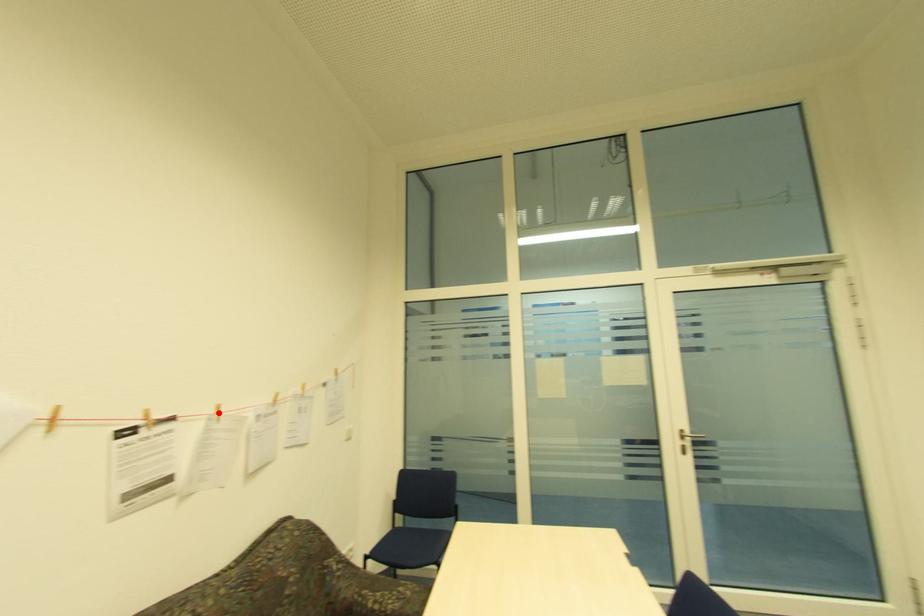
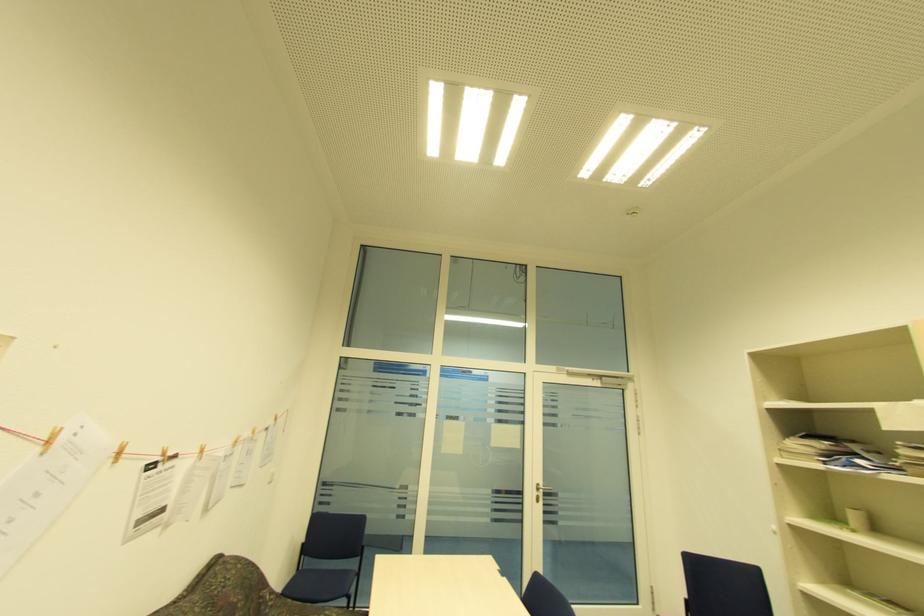
Find the pixel in the second image that matches the highlighted location in the first image.

(203, 453)